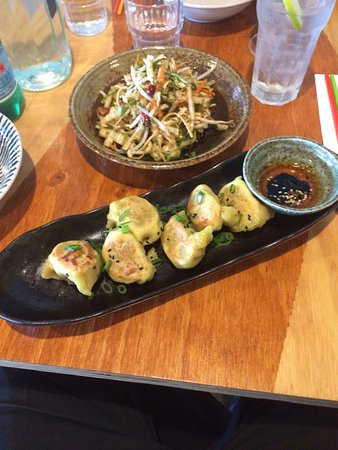
The width and height of the screenshot is (338, 450). What are the coordinates of `wooden table` in the screenshot? It's located at (250, 328).